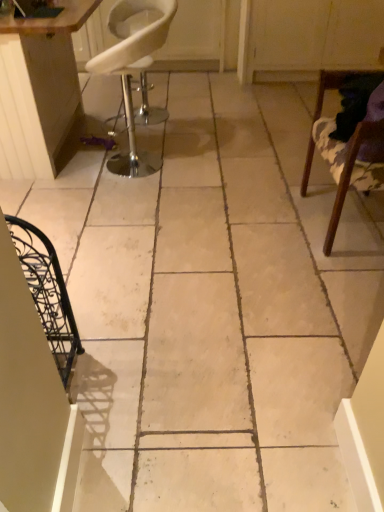
Question: Is wooden table at upper left to the right of white plastic chair at upper left, marked as the 2th chair in a right-to-left arrangement, from the viewer's perspective?

Choices:
 (A) no
 (B) yes

Answer: (A)

Question: From a real-world perspective, is wooden table at upper left located beneath white plastic chair at upper left, marked as the 2th chair in a right-to-left arrangement?

Choices:
 (A) no
 (B) yes

Answer: (A)

Question: From the image's perspective, does wooden table at upper left appear higher than white plastic chair at upper left, marked as the 2th chair in a right-to-left arrangement?

Choices:
 (A) yes
 (B) no

Answer: (A)

Question: Is wooden table at upper left looking in the opposite direction of white plastic chair at upper left, marked as the 2th chair in a right-to-left arrangement?

Choices:
 (A) yes
 (B) no

Answer: (B)

Question: From the image's perspective, would you say wooden table at upper left is shown under white plastic chair at upper left, which is counted as the first chair, starting from the left?

Choices:
 (A) no
 (B) yes

Answer: (A)

Question: Is wooden table at upper left bigger than white plastic chair at upper left, which is counted as the first chair, starting from the left?

Choices:
 (A) yes
 (B) no

Answer: (A)

Question: Considering the relative sizes of wooden table at upper left and wooden chair at right, which ranks as the second chair in left-to-right order, in the image provided, is wooden table at upper left taller than wooden chair at right, which ranks as the second chair in left-to-right order,?

Choices:
 (A) no
 (B) yes

Answer: (B)

Question: Is wooden table at upper left to the right of wooden chair at right, acting as the first chair starting from the right, from the viewer's perspective?

Choices:
 (A) yes
 (B) no

Answer: (B)

Question: Is wooden table at upper left far away from wooden chair at right, which ranks as the second chair in left-to-right order?

Choices:
 (A) yes
 (B) no

Answer: (A)

Question: From the image's perspective, would you say wooden table at upper left is shown under wooden chair at right, which ranks as the second chair in left-to-right order?

Choices:
 (A) yes
 (B) no

Answer: (B)

Question: Can you confirm if wooden table at upper left is shorter than wooden chair at right, acting as the first chair starting from the right?

Choices:
 (A) no
 (B) yes

Answer: (A)

Question: Considering the relative sizes of wooden table at upper left and wooden chair at right, acting as the first chair starting from the right, in the image provided, is wooden table at upper left smaller than wooden chair at right, acting as the first chair starting from the right,?

Choices:
 (A) yes
 (B) no

Answer: (B)

Question: Considering the relative sizes of white plastic chair at upper left, which is counted as the first chair, starting from the left, and wooden table at upper left in the image provided, is white plastic chair at upper left, which is counted as the first chair, starting from the left, thinner than wooden table at upper left?

Choices:
 (A) no
 (B) yes

Answer: (B)